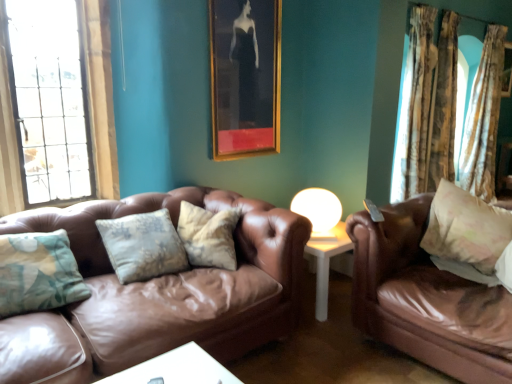
Question: From the image's perspective, is brown leather couch at left, acting as the 2th studio couch starting from the right, located above white glossy table lamp at center?

Choices:
 (A) yes
 (B) no

Answer: (B)

Question: Can you confirm if brown leather couch at left, acting as the 2th studio couch starting from the right, is taller than white glossy table lamp at center?

Choices:
 (A) yes
 (B) no

Answer: (A)

Question: Is brown leather couch at left, acting as the 2th studio couch starting from the right, located outside white glossy table lamp at center?

Choices:
 (A) no
 (B) yes

Answer: (B)

Question: Is white glossy table lamp at center at the back of brown leather couch at left, the first studio couch viewed from the left?

Choices:
 (A) yes
 (B) no

Answer: (B)

Question: From a real-world perspective, is brown leather couch at left, the first studio couch viewed from the left, on white glossy table lamp at center?

Choices:
 (A) no
 (B) yes

Answer: (A)

Question: Would you consider brown leather couch at left, acting as the 2th studio couch starting from the right, to be distant from white glossy table lamp at center?

Choices:
 (A) no
 (B) yes

Answer: (A)

Question: From a real-world perspective, is clear glass window at left located higher than white glossy table lamp at center?

Choices:
 (A) no
 (B) yes

Answer: (B)

Question: Can you confirm if clear glass window at left is taller than white glossy table lamp at center?

Choices:
 (A) no
 (B) yes

Answer: (B)

Question: Is clear glass window at left shorter than white glossy table lamp at center?

Choices:
 (A) yes
 (B) no

Answer: (B)

Question: Can you confirm if clear glass window at left is wider than white glossy table lamp at center?

Choices:
 (A) no
 (B) yes

Answer: (A)

Question: Is clear glass window at left oriented towards white glossy table lamp at center?

Choices:
 (A) no
 (B) yes

Answer: (A)

Question: Is clear glass window at left completely or partially outside of white glossy table lamp at center?

Choices:
 (A) yes
 (B) no

Answer: (A)

Question: Does textured beige curtain at right, marked as the first curtain in a left-to-right arrangement, have a smaller size compared to fluffy beige pillow at right?

Choices:
 (A) yes
 (B) no

Answer: (B)